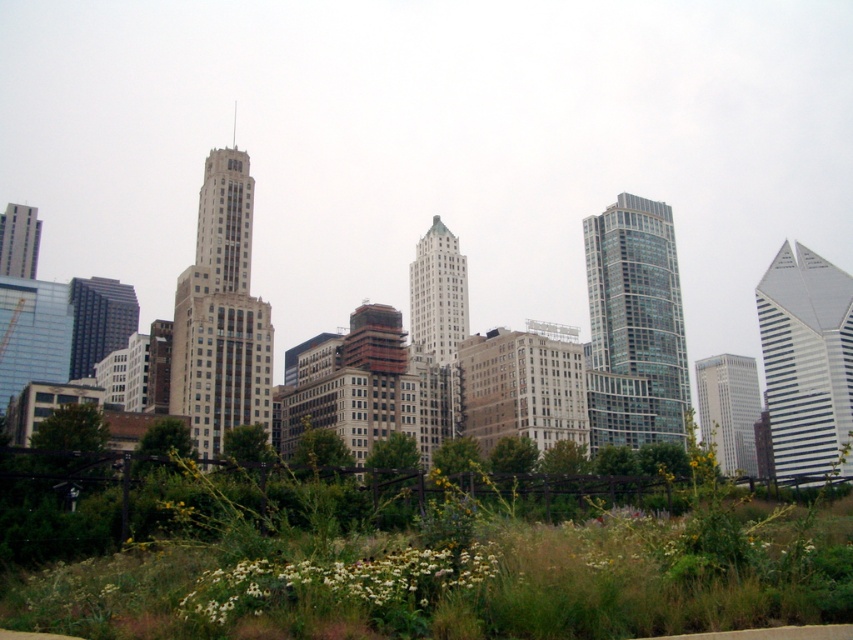
Who is shorter, white fluffy flowers at lower center or glassy silver skyscraper at center?

white fluffy flowers at lower center

Is point (306, 627) more distant than point (723, 369)?

No.

This screenshot has width=853, height=640. I want to click on white fluffy flowers at lower center, so click(440, 563).

I want to click on white fluffy flowers at lower center, so click(440, 563).

This screenshot has width=853, height=640. Describe the element at coordinates (805, 362) in the screenshot. I see `white glass skyscraper at right` at that location.

Does white glass skyscraper at right have a greater width compared to white glass skyscraper at center?

Yes, white glass skyscraper at right is wider than white glass skyscraper at center.

Is point (842, 296) positioned behind point (444, 400)?

Yes, point (842, 296) is behind point (444, 400).

This screenshot has height=640, width=853. In order to click on white glass skyscraper at right in this screenshot , I will do `click(805, 362)`.

Image resolution: width=853 pixels, height=640 pixels. What do you see at coordinates (99, 321) in the screenshot? I see `shiny glass skyscraper at center-left` at bounding box center [99, 321].

Does shiny glass skyscraper at center-left have a greater height compared to matte glass skyscraper at left?

Correct, shiny glass skyscraper at center-left is much taller as matte glass skyscraper at left.

Between point (71, 365) and point (20, 218), which one is positioned in front?

Point (71, 365)

Find the location of `shiny glass skyscraper at center-left`. shiny glass skyscraper at center-left is located at coordinates (99, 321).